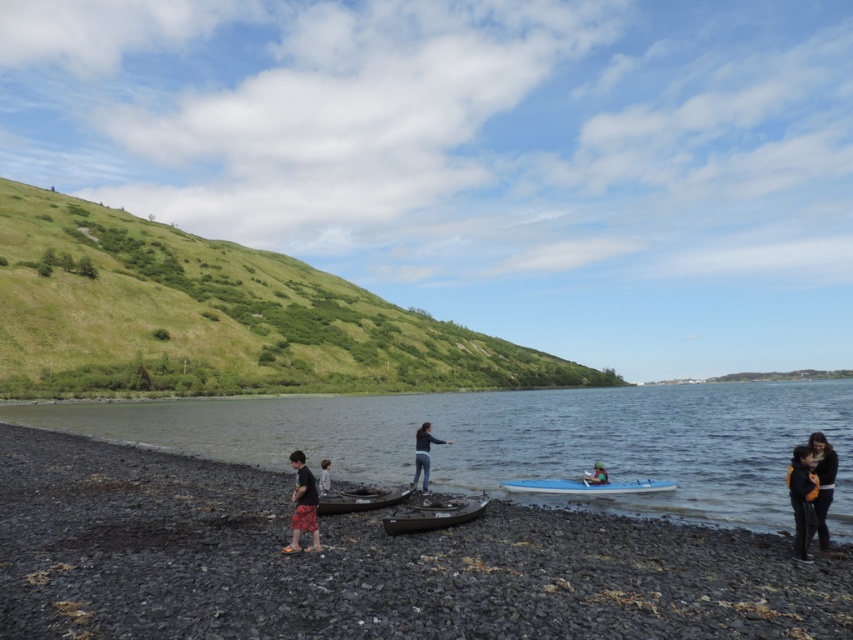
Who is positioned more to the left, orange life vest at lower right or blue glossy surfboard at center?

blue glossy surfboard at center is more to the left.

Is point (808, 509) closer to camera compared to point (602, 468)?

Yes.

Consider the image. Who is more forward, [793,468] or [593,467]?

Positioned in front is point [793,468].

The height and width of the screenshot is (640, 853). In order to click on orange life vest at lower right in this screenshot , I will do `click(802, 499)`.

This screenshot has height=640, width=853. Describe the element at coordinates (822, 483) in the screenshot. I see `dark brown leather jacket at lower right` at that location.

Does dark brown leather jacket at lower right have a greater height compared to black rubber canoe at center?

Indeed, dark brown leather jacket at lower right has a greater height compared to black rubber canoe at center.

This screenshot has height=640, width=853. I want to click on dark brown leather jacket at lower right, so click(822, 483).

I want to click on dark brown leather jacket at lower right, so 822,483.

Between light blue plastic canoe at center and dark brown leather jacket at lower right, which one is positioned lower?

light blue plastic canoe at center is lower down.

Between point (598, 488) and point (822, 504), which one is positioned behind?

The point (598, 488) is behind.

Locate an element on the screen. This screenshot has width=853, height=640. light blue plastic canoe at center is located at coordinates (587, 486).